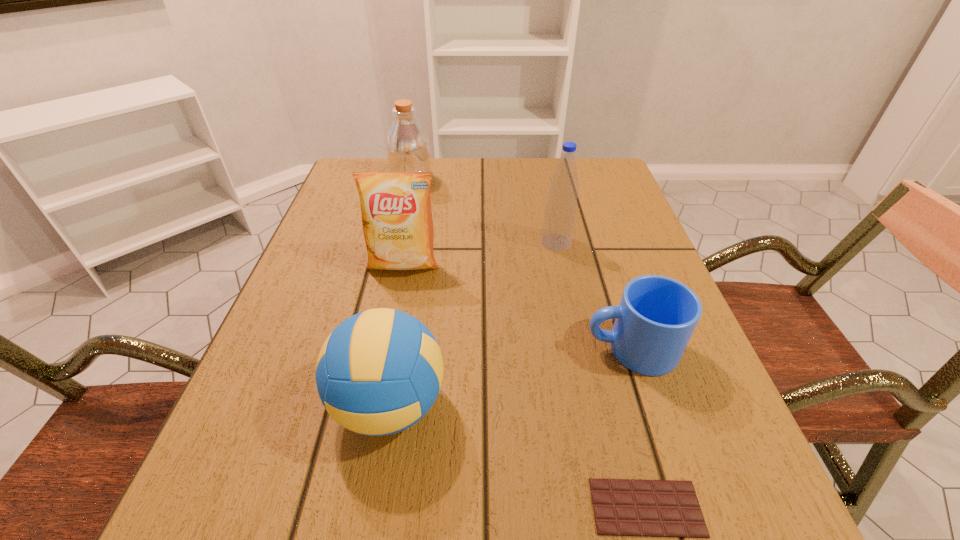
Identify the location of vacant space located on the right of the fourth tallest object. This screenshot has width=960, height=540. (676, 405).

You are a GUI agent. You are given a task and a screenshot of the screen. Output one action in this format:
    pyautogui.click(x=<x>, y=<y>)
    Task: Click on the free spot located on the side of the mug with the handle
    This screenshot has height=540, width=960.
    Given the screenshot: What is the action you would take?
    pyautogui.click(x=373, y=349)

The image size is (960, 540). Identify the location of vacant region located 0.150m on the side of the mug with the handle. 496,349.

I want to click on vacant space situated 0.110m on the side of the mug with the handle, so click(x=520, y=349).

In order to click on free spot located 0.240m on the back of the chocolate bar in this screenshot , I will do `click(602, 340)`.

You are a GUI agent. You are given a task and a screenshot of the screen. Output one action in this format:
    pyautogui.click(x=<x>, y=<y>)
    Task: Click on the object located at the far edge
    This screenshot has width=960, height=540.
    Given the screenshot: What is the action you would take?
    pyautogui.click(x=408, y=150)

Locate an element on the screen. The height and width of the screenshot is (540, 960). object at the near edge is located at coordinates (622, 507).

Locate an element on the screen. The height and width of the screenshot is (540, 960). bottle that is at the left edge is located at coordinates 408,150.

I want to click on crisp (potato chip) situated at the left edge, so click(x=397, y=222).

In order to click on volleyball positioned at the left edge in this screenshot , I will do `click(379, 372)`.